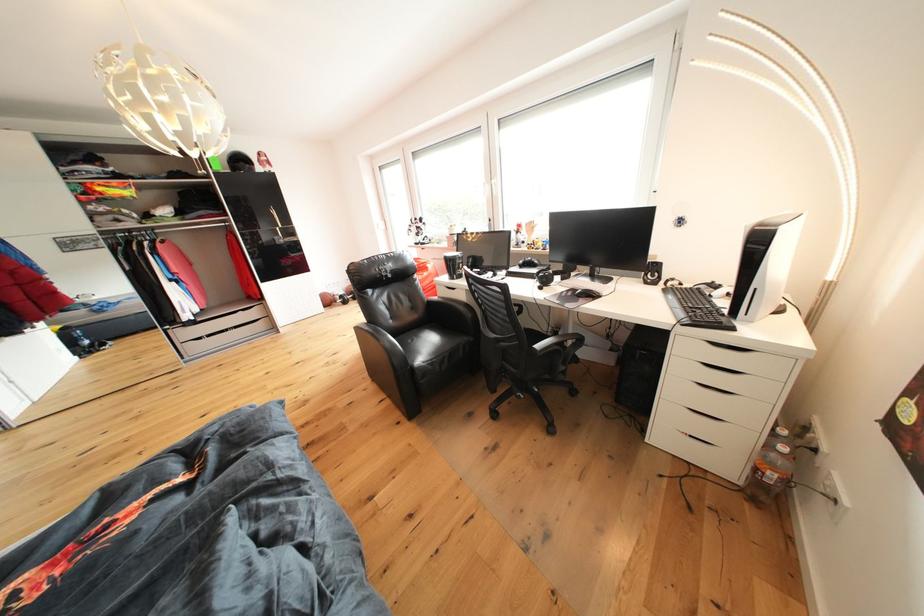
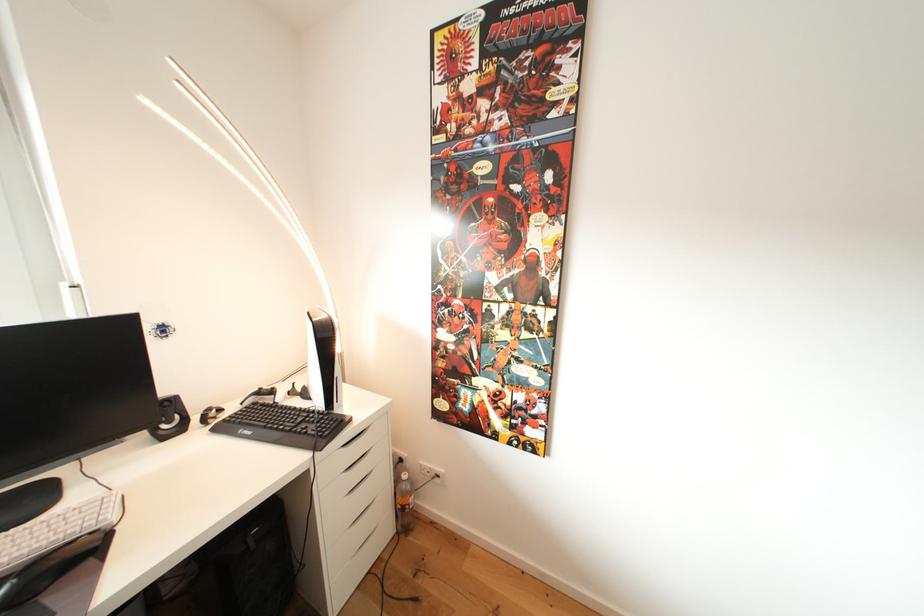
Locate, in the second image, the point that corresponds to [662,281] in the first image.

(178, 427)